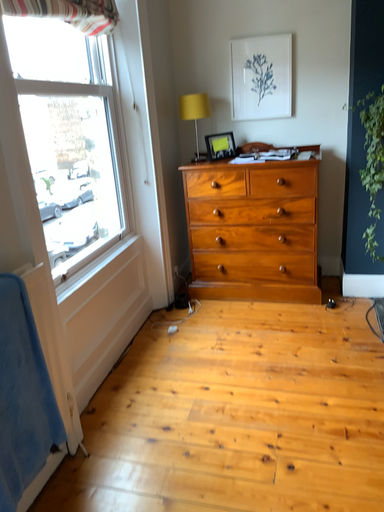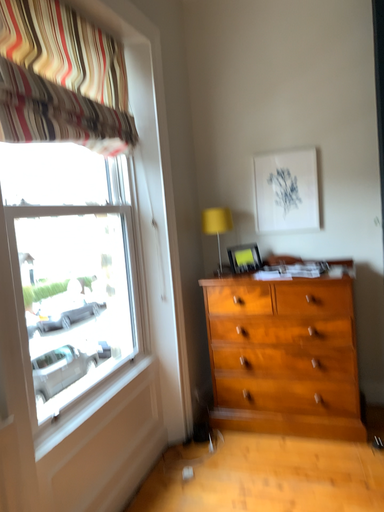
Question: Which way did the camera rotate in the video?

Choices:
 (A) rotated upward
 (B) rotated downward

Answer: (A)